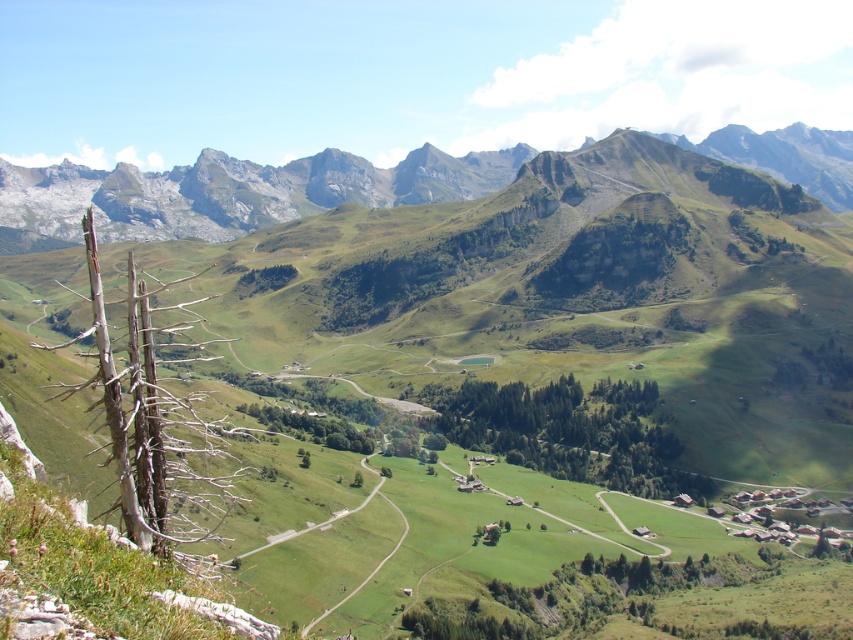
You are an artist planning to paint this mountain landscape. You want to emphasize the contrast between the dead wood at left and the green leafy trees at center. Which object should you make larger in your painting to highlight this contrast?

The dead wood at left is bigger than the green leafy trees at center, so to emphasize the contrast, you should paint the dead wood at left larger than the green leafy trees at center in your painting.

You are a hiker planning to take a photo of the rugged stone mountain range at upper center and the dead wood at left. Which object should you focus on first if you want to capture both in a single frame without moving your camera? Explain your reasoning based on their positions.

You should focus on the rugged stone mountain range at upper center first because it is taller than the dead wood at left, so adjusting the focus to the distant mountain ensures both will be in focus due to the depth of field.

You are standing at the viewpoint overlooking the mountain landscape. You notice two points marked in the scene. Which of the two points, point (148, 392) or point (502, 419), is closer to your current position?

Point (148, 392) is closer to the camera than point (502, 419), so it is closer to your current position.